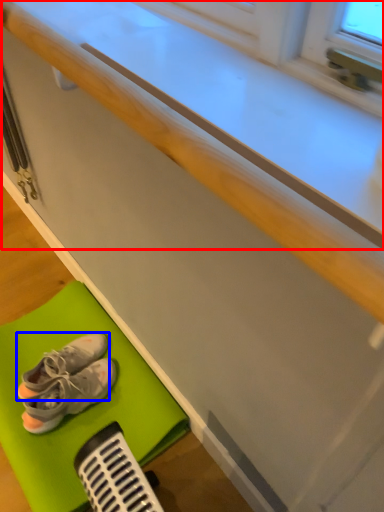
Question: Which of the following is the farthest to the observer, counter top (highlighted by a red box) or footwear (highlighted by a blue box)?

Choices:
 (A) counter top
 (B) footwear

Answer: (B)